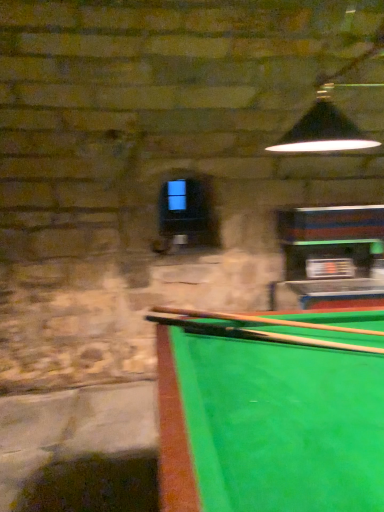
Question: Which direction should I rotate to face wooden cue at center, arranged as the 1th cue when viewed from the top, — up or down?

Choices:
 (A) up
 (B) down

Answer: (B)

Question: Is wooden cue at lower right, the 3th cue when ordered from top to bottom, positioned far away from wooden cue at center, arranged as the third cue when ordered from the bottom?

Choices:
 (A) no
 (B) yes

Answer: (A)

Question: From the image's perspective, does wooden cue at lower right, which is counted as the first cue, starting from the bottom, appear lower than wooden cue at center, arranged as the third cue when ordered from the bottom?

Choices:
 (A) no
 (B) yes

Answer: (B)

Question: Considering the relative sizes of wooden cue at lower right, the 3th cue when ordered from top to bottom, and wooden cue at center, arranged as the 1th cue when viewed from the top, in the image provided, is wooden cue at lower right, the 3th cue when ordered from top to bottom, bigger than wooden cue at center, arranged as the 1th cue when viewed from the top,?

Choices:
 (A) no
 (B) yes

Answer: (A)

Question: Is wooden cue at lower right, which is counted as the first cue, starting from the bottom, beside wooden cue at center, arranged as the third cue when ordered from the bottom?

Choices:
 (A) yes
 (B) no

Answer: (B)

Question: Can you confirm if wooden cue at lower right, the 3th cue when ordered from top to bottom, is positioned to the right of wooden cue at center, arranged as the 1th cue when viewed from the top?

Choices:
 (A) yes
 (B) no

Answer: (A)

Question: Can you confirm if wooden cue at lower right, which is counted as the first cue, starting from the bottom, is thinner than wooden cue at center, arranged as the third cue when ordered from the bottom?

Choices:
 (A) no
 (B) yes

Answer: (B)

Question: Considering the relative sizes of wooden cue at center, arranged as the 1th cue when viewed from the top, and wooden cue at lower right, the 3th cue when ordered from top to bottom, in the image provided, is wooden cue at center, arranged as the 1th cue when viewed from the top, smaller than wooden cue at lower right, the 3th cue when ordered from top to bottom,?

Choices:
 (A) yes
 (B) no

Answer: (B)

Question: Would you consider wooden cue at center, arranged as the 1th cue when viewed from the top, to be distant from wooden cue at lower right, which is counted as the first cue, starting from the bottom?

Choices:
 (A) yes
 (B) no

Answer: (B)

Question: Is wooden cue at center, arranged as the third cue when ordered from the bottom, not within wooden cue at lower right, which is counted as the first cue, starting from the bottom?

Choices:
 (A) yes
 (B) no

Answer: (A)

Question: Does wooden cue at center, arranged as the third cue when ordered from the bottom, turn towards wooden cue at lower right, the 3th cue when ordered from top to bottom?

Choices:
 (A) yes
 (B) no

Answer: (B)

Question: Does wooden cue at center, arranged as the 1th cue when viewed from the top, have a lesser height compared to wooden cue at lower right, which is counted as the first cue, starting from the bottom?

Choices:
 (A) yes
 (B) no

Answer: (B)

Question: Does wooden cue at center, arranged as the 1th cue when viewed from the top, appear on the left side of wooden cue at lower right, which is counted as the first cue, starting from the bottom?

Choices:
 (A) no
 (B) yes

Answer: (B)

Question: Can you confirm if wooden cue at lower right, the 3th cue when ordered from top to bottom, is bigger than smooth wood cue at center, which is counted as the second cue, starting from the top?

Choices:
 (A) yes
 (B) no

Answer: (B)